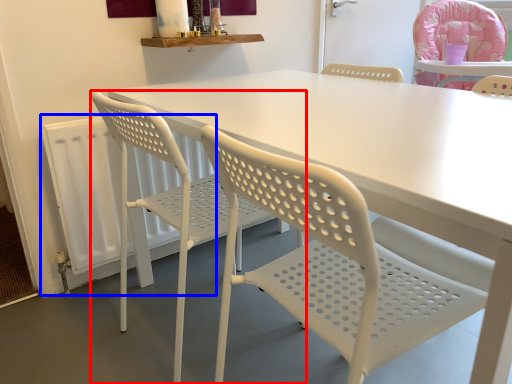
Question: Which object is further to the camera taking this photo, chair (highlighted by a red box) or radiator (highlighted by a blue box)?

Choices:
 (A) chair
 (B) radiator

Answer: (B)